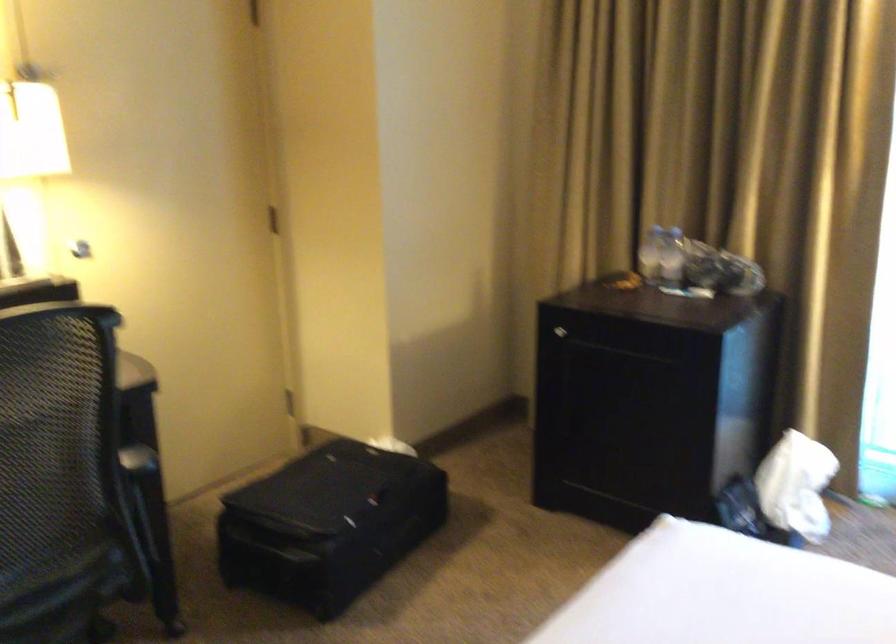
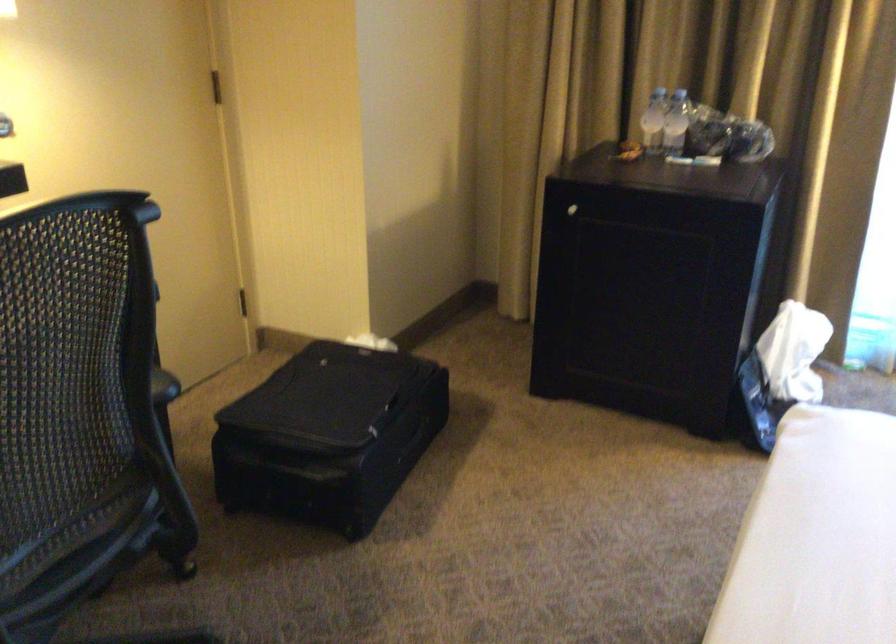
Find the pixel in the second image that matches [701,266] in the first image.

(708, 131)